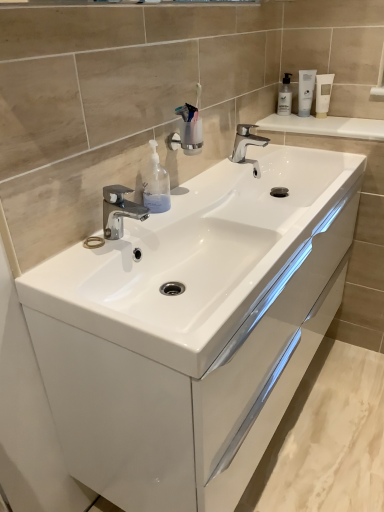
Question: Can we say white glossy lotion at upper right lies outside transparent plastic soap dispenser at center, which is the first soap dispenser from left to right?

Choices:
 (A) no
 (B) yes

Answer: (B)

Question: Is white glossy lotion at upper right touching transparent plastic soap dispenser at center, which is the first soap dispenser from left to right?

Choices:
 (A) yes
 (B) no

Answer: (B)

Question: Is white glossy lotion at upper right thinner than transparent plastic soap dispenser at center, the 1th soap dispenser from the bottom?

Choices:
 (A) no
 (B) yes

Answer: (B)

Question: Does white glossy lotion at upper right have a greater height compared to transparent plastic soap dispenser at center, which is counted as the 2th soap dispenser, starting from the back?

Choices:
 (A) yes
 (B) no

Answer: (A)

Question: Is white glossy lotion at upper right smaller than transparent plastic soap dispenser at center, which is counted as the 2th soap dispenser, starting from the back?

Choices:
 (A) yes
 (B) no

Answer: (A)

Question: Is white glossy lotion at upper right to the left of transparent plastic soap dispenser at center, the first soap dispenser positioned from the front, from the viewer's perspective?

Choices:
 (A) yes
 (B) no

Answer: (B)

Question: Is white glossy tube at upper right further to camera compared to polished chrome tap at center, the second tap when ordered from top to bottom?

Choices:
 (A) yes
 (B) no

Answer: (A)

Question: Is white glossy tube at upper right located outside polished chrome tap at center, the second tap when ordered from top to bottom?

Choices:
 (A) no
 (B) yes

Answer: (B)

Question: From a real-world perspective, is white glossy tube at upper right physically below polished chrome tap at center, arranged as the first tap when viewed from the left?

Choices:
 (A) yes
 (B) no

Answer: (B)

Question: Are white glossy tube at upper right and polished chrome tap at center, the 1th tap ordered from the bottom, located far from each other?

Choices:
 (A) no
 (B) yes

Answer: (B)

Question: Can you confirm if white glossy tube at upper right is smaller than polished chrome tap at center, the 1th tap ordered from the bottom?

Choices:
 (A) no
 (B) yes

Answer: (B)

Question: Is white glossy tube at upper right shorter than polished chrome tap at center, the 2th tap positioned from the back?

Choices:
 (A) no
 (B) yes

Answer: (A)

Question: Is polished chrome tap at center, arranged as the first tap when viewed from the left, smaller than white glossy cabinet at center?

Choices:
 (A) no
 (B) yes

Answer: (B)